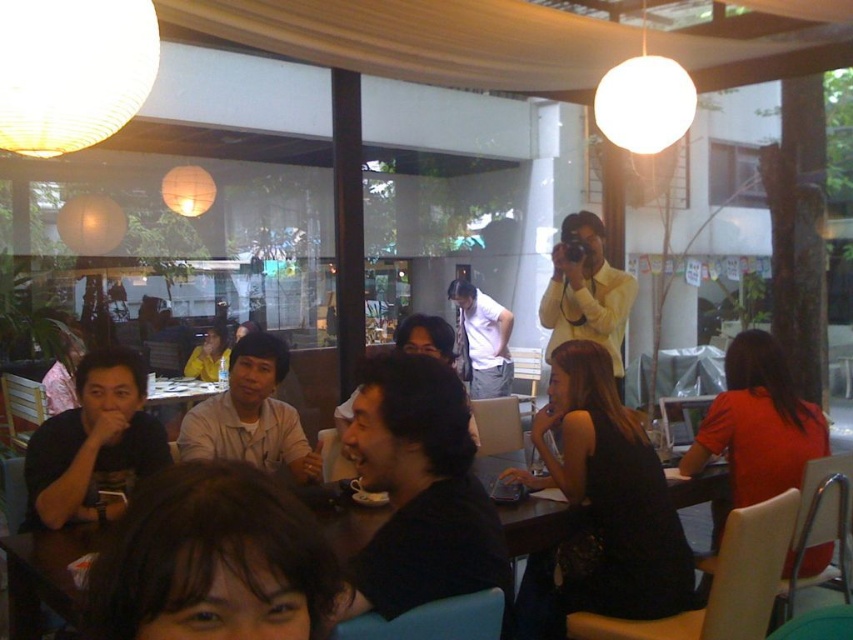
You are a customer at the cafe and want to sit between the black matte dress at center and the red matte shirt at right. Is there enough space for you to sit comfortably?

The black matte dress at center might be wider than red matte shirt at right, so there may not be enough space between them for a customer to sit comfortably.

You are a photographer standing in the center of the cafe. You want to take a photo of the black matte dress at center without moving any objects. Can you capture the dress clearly in your shot from your current position?

The black matte dress at center is 2.20 meters from camera, so yes, you can capture the dress clearly in your shot from your current position since it is within a typical camera focus range.

You are a customer entering the cafe and want to sit at the table where the black matte dress at center and red matte shirt at right are located. Which one should you walk around to reach the table?

You should walk around the red matte shirt at right to reach the table because the black matte dress at center is in front of it, so going around the red matte shirt at right would allow you to access the table.